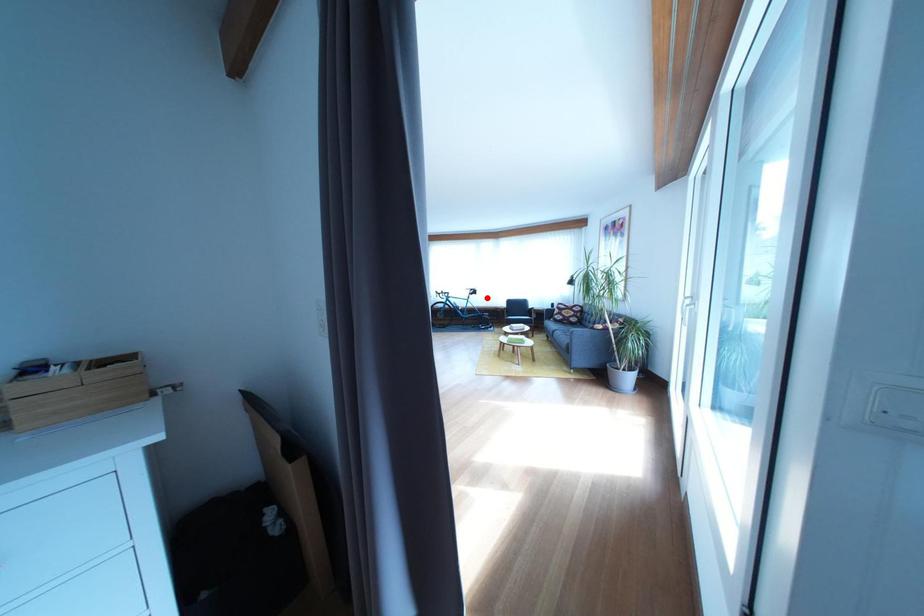
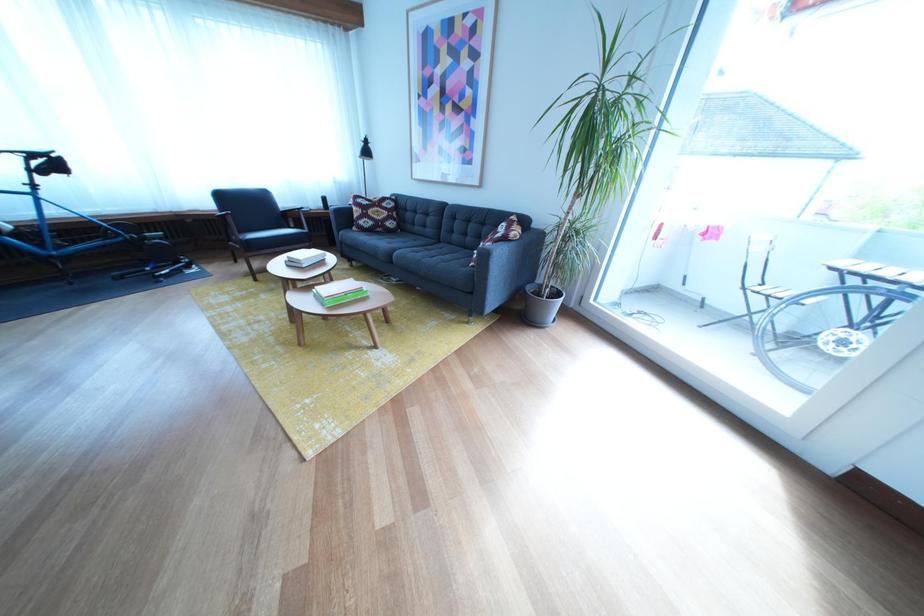
Question: I am providing you with two images of the same scene from different viewpoints. In image1, a red point is highlighted. Considering the same 3D point in image2, which of the following is correct?

Choices:
 (A) It is closer
 (B) It is farther

Answer: (B)